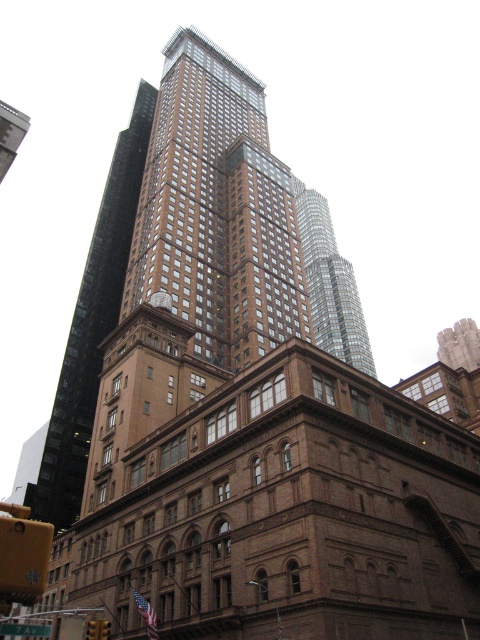
Question: Which point is closer to the camera?

Choices:
 (A) (91, 374)
 (B) (312, 272)

Answer: (A)

Question: Does brown glassy building at center appear over glassy reflective skyscraper at center?

Choices:
 (A) yes
 (B) no

Answer: (B)

Question: Is brown glassy building at center positioned behind glassy reflective skyscraper at center?

Choices:
 (A) yes
 (B) no

Answer: (B)

Question: Is the position of brown glassy building at center less distant than that of glassy reflective skyscraper at center?

Choices:
 (A) yes
 (B) no

Answer: (A)